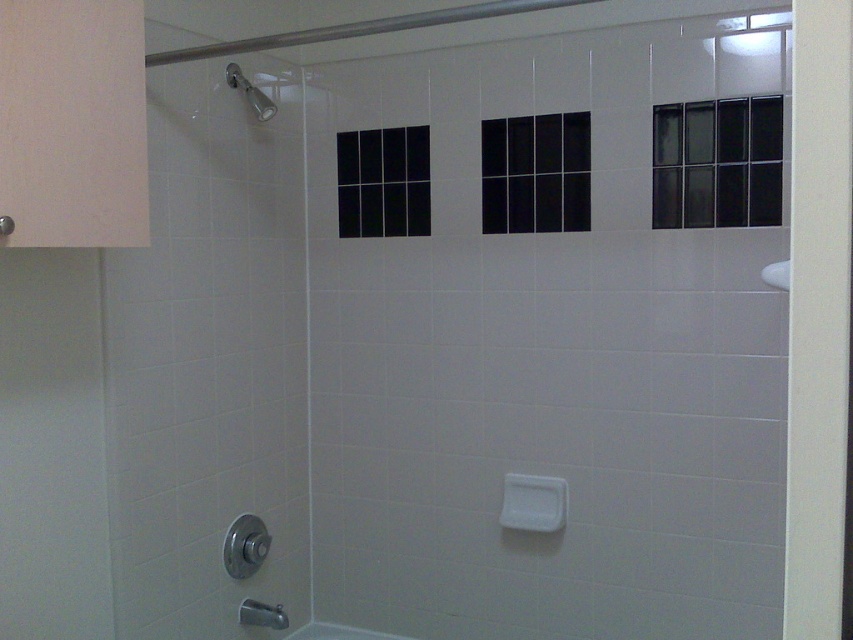
Is point (331, 632) closer to camera compared to point (766, 276)?

No, it is not.

Between white glossy bath at lower center and white glossy sink at right, which one appears on the right side from the viewer's perspective?

white glossy sink at right

Which is in front, point (364, 634) or point (776, 273)?

Positioned in front is point (776, 273).

Image resolution: width=853 pixels, height=640 pixels. I want to click on white glossy bath at lower center, so click(x=338, y=632).

Is black glass door at upper right taller than white glossy sink at right?

Yes, black glass door at upper right is taller than white glossy sink at right.

Is black glass door at upper right positioned behind white glossy sink at right?

That is True.

Which is behind, point (738, 172) or point (775, 260)?

The point (738, 172) is behind.

The width and height of the screenshot is (853, 640). I want to click on black glass door at upper right, so click(717, 163).

What do you see at coordinates (250, 92) in the screenshot? I see `satin nickel showerhead at upper left` at bounding box center [250, 92].

Which is behind, point (251, 86) or point (779, 276)?

Positioned behind is point (251, 86).

Who is more distant from viewer, (241, 80) or (772, 285)?

Point (241, 80)

Locate an element on the screen. satin nickel showerhead at upper left is located at coordinates (250, 92).